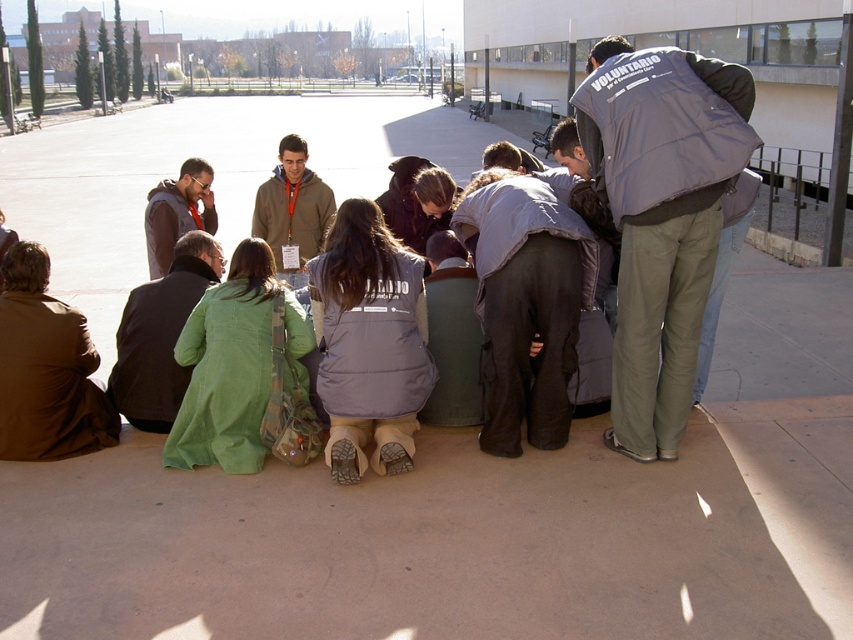
Is point (704, 292) positioned after point (283, 264)?

No, (704, 292) is in front of (283, 264).

This screenshot has width=853, height=640. What do you see at coordinates (660, 218) in the screenshot?
I see `gray puffy vest at center` at bounding box center [660, 218].

Does point (628, 51) come farther from viewer compared to point (315, 209)?

No, it is in front of (315, 209).

The height and width of the screenshot is (640, 853). I want to click on gray puffy vest at center, so click(x=660, y=218).

Which of these two, green fabric jacket at lower left or matte brown jacket at lower left, stands taller?

green fabric jacket at lower left is taller.

Which is in front, point (141, 310) or point (190, 209)?

Positioned in front is point (141, 310).

Find the location of `green fabric jacket at lower left`. green fabric jacket at lower left is located at coordinates (160, 336).

Is matte brown hoodie at center thinner than matte brown jacket at lower left?

In fact, matte brown hoodie at center might be wider than matte brown jacket at lower left.

Which is behind, point (294, 243) or point (161, 204)?

Positioned behind is point (294, 243).

The height and width of the screenshot is (640, 853). In order to click on matte brown hoodie at center in this screenshot , I will do `click(292, 211)`.

Locate an element on the screen. Image resolution: width=853 pixels, height=640 pixels. matte brown hoodie at center is located at coordinates (292, 211).